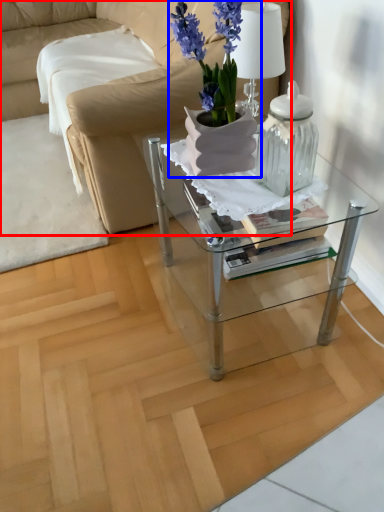
Question: Which point is further to the camera, studio couch (highlighted by a red box) or houseplant (highlighted by a blue box)?

Choices:
 (A) studio couch
 (B) houseplant

Answer: (A)